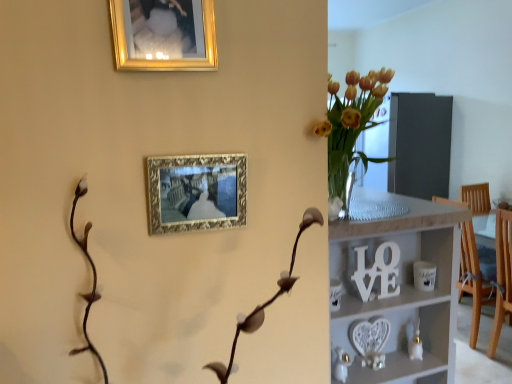
Question: From the image's perspective, is gold ornate picture frame at upper center, the second picture frame viewed from the top, located above or below gold metallic picture frame at upper center, which is the second picture frame from bottom to top?

Choices:
 (A) below
 (B) above

Answer: (A)

Question: Considering the positions of point [x=194, y=173] and point [x=164, y=39], is point [x=194, y=173] closer or farther from the camera than point [x=164, y=39]?

Choices:
 (A) closer
 (B) farther

Answer: (B)

Question: Considering the real-world distances, which object is closest to the white wooden shelf at center?

Choices:
 (A) gold metallic picture frame at upper center, which is the second picture frame from bottom to top
 (B) gold ornate picture frame at upper center, the second picture frame viewed from the top

Answer: (B)

Question: Estimate the real-world distances between objects in this image. Which object is farther from the gold ornate picture frame at upper center, the second picture frame viewed from the top?

Choices:
 (A) gold metallic picture frame at upper center, the first picture frame in the top-to-bottom sequence
 (B) white wooden shelf at center

Answer: (B)